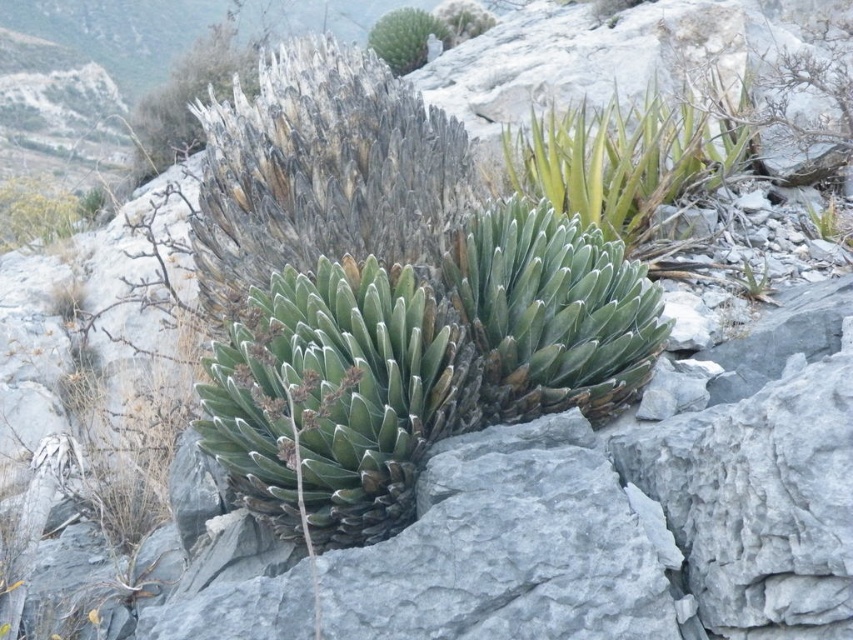
You are a botanist examining the rocky terrain. You need to determine which plant is closer to you between the green leafy plant at upper right and the green succulent at upper center. Which one is closer?

The green leafy plant at upper right is closer to you because it is in front of the green succulent at upper center.

You are standing in the rocky terrain and want to place a small flag at the point closer to you. Which point should you choose between point [666,198] and point [445,45]?

Point [666,198] is closer to the viewer than point [445,45], so you should choose point [666,198] to place the small flag.

You are a botanist examining the rocky terrain. You notice the green leafy plant at upper right and the green succulent at upper center. Which of these two plants is located beneath the other?

The green leafy plant at upper right is positioned under the green succulent at upper center.